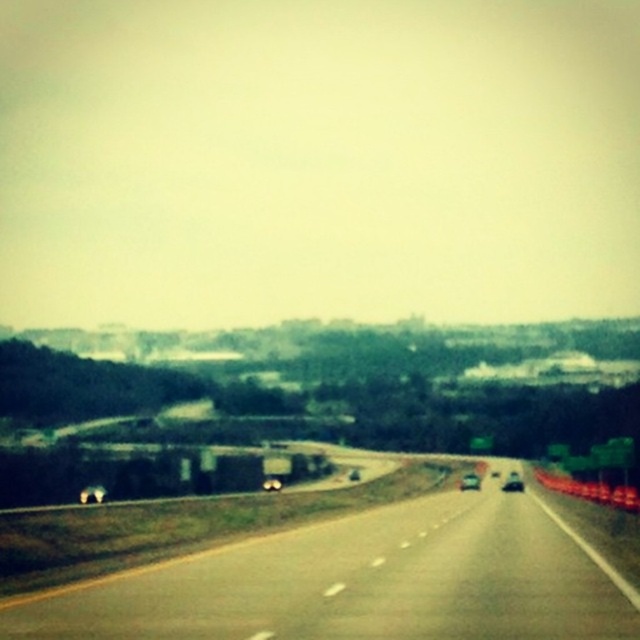
Does asphalt road at center have a lesser width compared to shiny silver sedan at center?

In fact, asphalt road at center might be wider than shiny silver sedan at center.

This screenshot has height=640, width=640. What are the coordinates of `asphalt road at center` in the screenshot? It's located at (356, 582).

Who is positioned more to the right, asphalt road at center or black glossy car at center?

black glossy car at center

The width and height of the screenshot is (640, 640). What do you see at coordinates (356, 582) in the screenshot? I see `asphalt road at center` at bounding box center [356, 582].

Is point (538, 609) closer to camera compared to point (515, 476)?

Yes, point (538, 609) is in front of point (515, 476).

Where is `asphalt road at center`? This screenshot has width=640, height=640. asphalt road at center is located at coordinates (356, 582).

Where is `shiny silver sedan at center`? The width and height of the screenshot is (640, 640). shiny silver sedan at center is located at coordinates (468, 481).

Is shiny silver sedan at center taller than black glossy car at center?

Yes, shiny silver sedan at center is taller than black glossy car at center.

Identify the location of shiny silver sedan at center. The width and height of the screenshot is (640, 640). (468, 481).

Identify the location of shiny silver sedan at center. (468, 481).